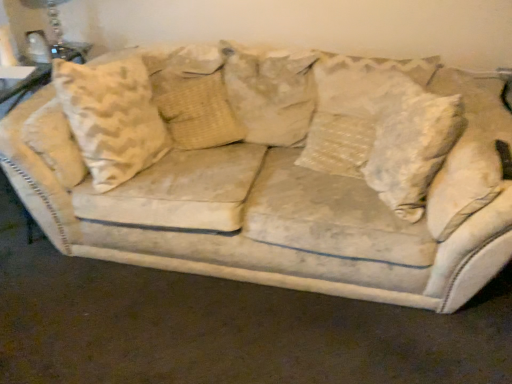
Measure the distance between point (242, 128) and camera.

The depth of point (242, 128) is 2.15 meters.

Image resolution: width=512 pixels, height=384 pixels. Identify the location of clear glass table lamp at upper left. (59, 31).

Image resolution: width=512 pixels, height=384 pixels. What are the coordinates of `beige fabric pillow at center, which is counted as the 2th pillow, starting from the left` in the screenshot? It's located at (270, 92).

Which of these two, clear glass table lamp at upper left or beige textured pillow at center, which ranks as the 1th pillow in left-to-right order, is thinner?

beige textured pillow at center, which ranks as the 1th pillow in left-to-right order.

Does clear glass table lamp at upper left touch beige textured pillow at center, arranged as the 3th pillow when viewed from the right?

No, clear glass table lamp at upper left is not next to beige textured pillow at center, arranged as the 3th pillow when viewed from the right.

Is point (72, 44) less distant than point (160, 89)?

No, (72, 44) is further to viewer.

At what (x,y) coordinates should I click in order to perform the action: click on the 1st pillow in front of the clear glass table lamp at upper left, starting your count from the anchor. Please return your answer as a coordinate pair (x, y). The width and height of the screenshot is (512, 384). Looking at the image, I should click on (193, 97).

Based on the photo, is white textured pillow at center, which is counted as the 3th pillow, starting from the left, a part of clear glass table lamp at upper left?

No, white textured pillow at center, which is counted as the 3th pillow, starting from the left, is not surrounded by clear glass table lamp at upper left.

Between clear glass table lamp at upper left and white textured pillow at center, which is counted as the 3th pillow, starting from the left, which one has smaller width?

Thinner between the two is clear glass table lamp at upper left.

Can you confirm if clear glass table lamp at upper left is smaller than white textured pillow at center, which is counted as the 3th pillow, starting from the left?

Yes.

From the image's perspective, which object appears higher, beige fabric pillow at center, which is counted as the 2th pillow, starting from the left, or white textured pillow at center, arranged as the first pillow when viewed from the right?

beige fabric pillow at center, which is counted as the 2th pillow, starting from the left, from the image's perspective.

Does beige fabric pillow at center, arranged as the 2th pillow when viewed from the right, appear on the left side of white textured pillow at center, arranged as the first pillow when viewed from the right?

Correct, you'll find beige fabric pillow at center, arranged as the 2th pillow when viewed from the right, to the left of white textured pillow at center, arranged as the first pillow when viewed from the right.

Can you confirm if beige fabric pillow at center, arranged as the 2th pillow when viewed from the right, is taller than white textured pillow at center, arranged as the first pillow when viewed from the right?

Incorrect, the height of beige fabric pillow at center, arranged as the 2th pillow when viewed from the right, is not larger of that of white textured pillow at center, arranged as the first pillow when viewed from the right.

From a real-world perspective, which object rests below the other?

beige textured pillow at center, arranged as the 3th pillow when viewed from the right, from a real-world perspective.

Which object is positioned more to the left, white textured pillow at center, which is counted as the 3th pillow, starting from the left, or beige textured pillow at center, which ranks as the 1th pillow in left-to-right order?

Positioned to the left is beige textured pillow at center, which ranks as the 1th pillow in left-to-right order.

Based on the photo, is white textured pillow at center, which is counted as the 3th pillow, starting from the left, facing away from beige textured pillow at center, which ranks as the 1th pillow in left-to-right order?

white textured pillow at center, which is counted as the 3th pillow, starting from the left, is not turned away from beige textured pillow at center, which ranks as the 1th pillow in left-to-right order.

Is beige textured pillow at center, which ranks as the 1th pillow in left-to-right order, inside beige fabric pillow at center, which is counted as the 2th pillow, starting from the left?

That's correct, beige textured pillow at center, which ranks as the 1th pillow in left-to-right order, is inside beige fabric pillow at center, which is counted as the 2th pillow, starting from the left.

From a real-world perspective, does beige fabric pillow at center, which is counted as the 2th pillow, starting from the left, stand above beige textured pillow at center, which ranks as the 1th pillow in left-to-right order?

Yes, from a real-world perspective, beige fabric pillow at center, which is counted as the 2th pillow, starting from the left, is on top of beige textured pillow at center, which ranks as the 1th pillow in left-to-right order.

Could you tell me if beige fabric pillow at center, which is counted as the 2th pillow, starting from the left, is facing beige textured pillow at center, which ranks as the 1th pillow in left-to-right order?

No, beige fabric pillow at center, which is counted as the 2th pillow, starting from the left, does not turn towards beige textured pillow at center, which ranks as the 1th pillow in left-to-right order.

Considering the relative positions of beige fabric pillow at center, which is counted as the 2th pillow, starting from the left, and beige textured pillow at center, arranged as the 3th pillow when viewed from the right, in the image provided, is beige fabric pillow at center, which is counted as the 2th pillow, starting from the left, to the left or to the right of beige textured pillow at center, arranged as the 3th pillow when viewed from the right,?

beige fabric pillow at center, which is counted as the 2th pillow, starting from the left, is to the right of beige textured pillow at center, arranged as the 3th pillow when viewed from the right.

Can you see beige textured pillow at center, arranged as the 3th pillow when viewed from the right, touching white textured pillow at center, which is counted as the 3th pillow, starting from the left?

There is a gap between beige textured pillow at center, arranged as the 3th pillow when viewed from the right, and white textured pillow at center, which is counted as the 3th pillow, starting from the left.

Does beige textured pillow at center, arranged as the 3th pillow when viewed from the right, lie behind white textured pillow at center, which is counted as the 3th pillow, starting from the left?

Yes, the depth of beige textured pillow at center, arranged as the 3th pillow when viewed from the right, is greater than that of white textured pillow at center, which is counted as the 3th pillow, starting from the left.

Which of these two, beige textured pillow at center, arranged as the 3th pillow when viewed from the right, or white textured pillow at center, arranged as the first pillow when viewed from the right, stands taller?

With more height is white textured pillow at center, arranged as the first pillow when viewed from the right.

Consider the image. Is beige textured pillow at center, arranged as the 3th pillow when viewed from the right, oriented towards clear glass table lamp at upper left?

No.

Which is more to the left, beige textured pillow at center, arranged as the 3th pillow when viewed from the right, or clear glass table lamp at upper left?

clear glass table lamp at upper left.

From the image's perspective, is beige textured pillow at center, which ranks as the 1th pillow in left-to-right order, on clear glass table lamp at upper left?

No, from the image's perspective, beige textured pillow at center, which ranks as the 1th pillow in left-to-right order, is not above clear glass table lamp at upper left.

Image resolution: width=512 pixels, height=384 pixels. I want to click on table lamp on the left of beige textured pillow at center, which ranks as the 1th pillow in left-to-right order, so click(59, 31).

Identify the location of the 3rd pillow below the clear glass table lamp at upper left (from the image's perspective). The width and height of the screenshot is (512, 384). (337, 144).

Looking at the image, which one is located further to white textured pillow at center, which is counted as the 3th pillow, starting from the left, clear glass table lamp at upper left or beige textured pillow at center, arranged as the 3th pillow when viewed from the right?

Among the two, clear glass table lamp at upper left is located further to white textured pillow at center, which is counted as the 3th pillow, starting from the left.

Based on their spatial positions, is beige textured pillow at center, which ranks as the 1th pillow in left-to-right order, or white textured pillow at center, arranged as the first pillow when viewed from the right, closer to clear glass table lamp at upper left?

Among the two, beige textured pillow at center, which ranks as the 1th pillow in left-to-right order, is located nearer to clear glass table lamp at upper left.

Considering their positions, is white textured pillow at center, which is counted as the 3th pillow, starting from the left, positioned further to clear glass table lamp at upper left than beige textured pillow at center, which ranks as the 1th pillow in left-to-right order?

white textured pillow at center, which is counted as the 3th pillow, starting from the left, lies further to clear glass table lamp at upper left than the other object.

Based on their spatial positions, is beige fabric pillow at center, which is counted as the 2th pillow, starting from the left, or clear glass table lamp at upper left further from white textured pillow at center, arranged as the first pillow when viewed from the right?

clear glass table lamp at upper left.

From the image, which object appears to be nearer to beige textured pillow at center, which ranks as the 1th pillow in left-to-right order, clear glass table lamp at upper left or beige fabric pillow at center, arranged as the 2th pillow when viewed from the right?

beige fabric pillow at center, arranged as the 2th pillow when viewed from the right, is closer to beige textured pillow at center, which ranks as the 1th pillow in left-to-right order.

Considering their positions, is beige fabric pillow at center, arranged as the 2th pillow when viewed from the right, positioned further to beige textured pillow at center, arranged as the 3th pillow when viewed from the right, than clear glass table lamp at upper left?

The object further to beige textured pillow at center, arranged as the 3th pillow when viewed from the right, is clear glass table lamp at upper left.

Looking at the image, which one is located closer to beige textured pillow at center, which ranks as the 1th pillow in left-to-right order, clear glass table lamp at upper left or white textured pillow at center, which is counted as the 3th pillow, starting from the left?

white textured pillow at center, which is counted as the 3th pillow, starting from the left, lies closer to beige textured pillow at center, which ranks as the 1th pillow in left-to-right order, than the other object.

Which object lies nearer to the anchor point beige textured pillow at center, arranged as the 3th pillow when viewed from the right, beige fabric pillow at center, arranged as the 2th pillow when viewed from the right, or white textured pillow at center, which is counted as the 3th pillow, starting from the left?

beige fabric pillow at center, arranged as the 2th pillow when viewed from the right, lies closer to beige textured pillow at center, arranged as the 3th pillow when viewed from the right, than the other object.

Find the location of a particular element. The height and width of the screenshot is (384, 512). pillow between beige textured pillow at center, arranged as the 3th pillow when viewed from the right, and white textured pillow at center, arranged as the first pillow when viewed from the right, from left to right is located at coordinates (270, 92).

Where is `pillow between clear glass table lamp at upper left and beige fabric pillow at center, which is counted as the 2th pillow, starting from the left, in the horizontal direction`? pillow between clear glass table lamp at upper left and beige fabric pillow at center, which is counted as the 2th pillow, starting from the left, in the horizontal direction is located at coordinates (193, 97).